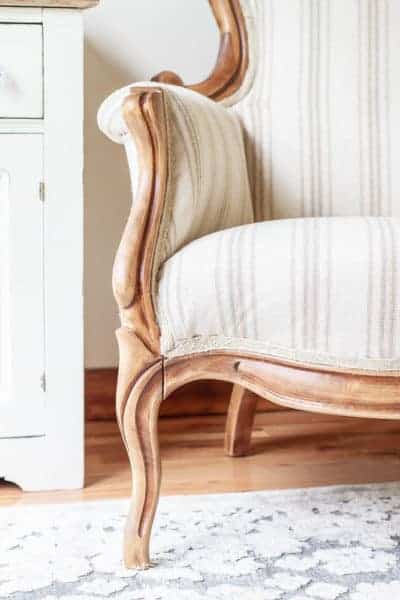
Identify the location of dresser. (48, 163).